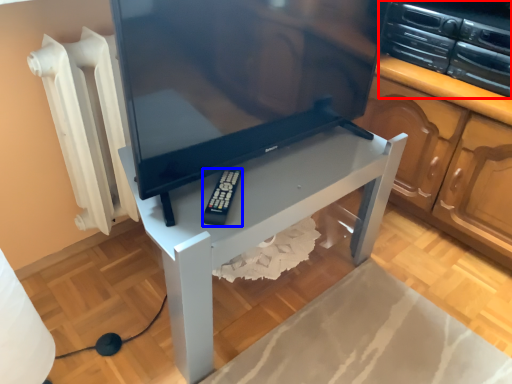
Question: Among these objects, which one is farthest to the camera, appliance (highlighted by a red box) or equipment (highlighted by a blue box)?

Choices:
 (A) appliance
 (B) equipment

Answer: (A)